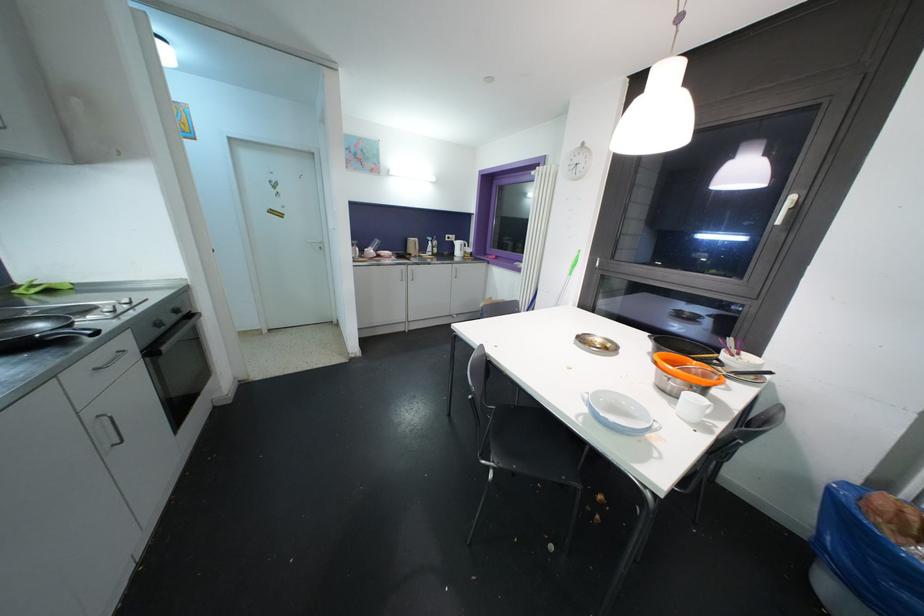
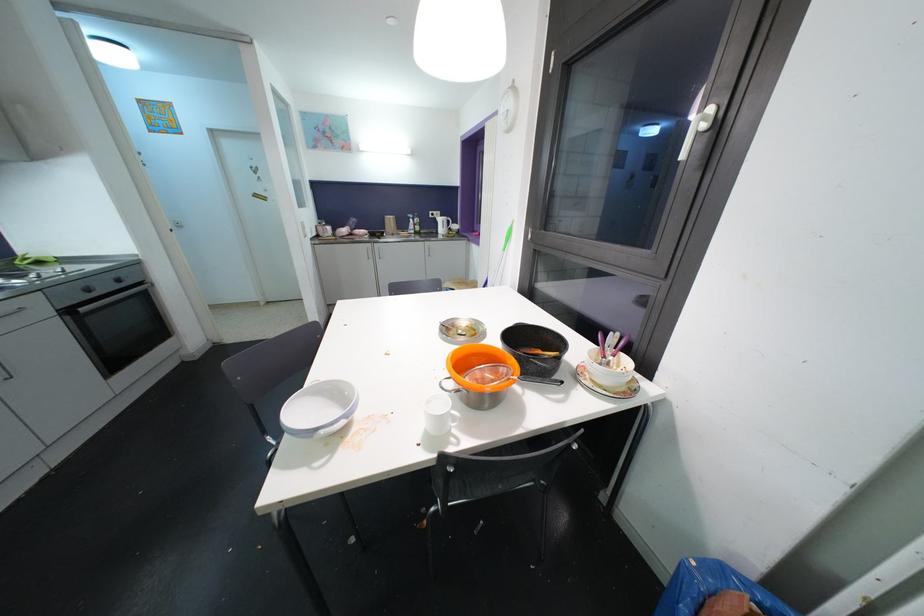
In the second image, find the point that corresponds to pixel 460 246 in the first image.

(444, 223)